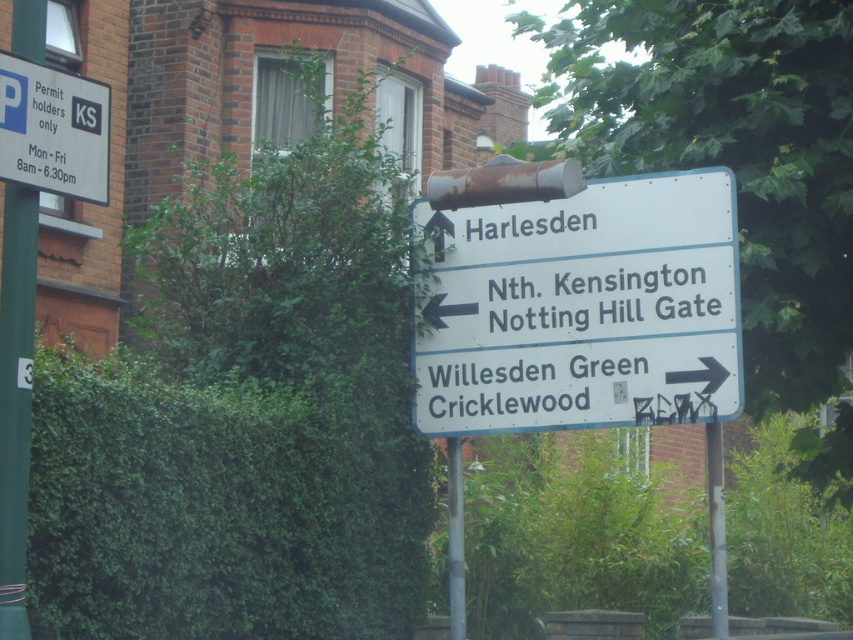
Question: Observing the image, what is the correct spatial positioning of white plastic sign at upper center in reference to green painted metal pole at left?

Choices:
 (A) above
 (B) below

Answer: (A)

Question: Which point is farther to the camera?

Choices:
 (A) green leafy hedge at lower left
 (B) white plastic parking sign at upper left

Answer: (A)

Question: Which of these objects is positioned closest to the white plastic sign at upper center?

Choices:
 (A) white plastic parking sign at upper left
 (B) green leafy hedge at lower left
 (C) green painted metal pole at left

Answer: (B)

Question: Estimate the real-world distances between objects in this image. Which object is farther from the green painted metal pole at left?

Choices:
 (A) white plastic parking sign at upper left
 (B) white plastic sign at upper center
 (C) green leafy hedge at lower left

Answer: (B)

Question: Can you confirm if green leafy hedge at lower left is thinner than white plastic parking sign at upper left?

Choices:
 (A) yes
 (B) no

Answer: (B)

Question: Can you confirm if green leafy hedge at lower left is wider than white plastic sign at upper center?

Choices:
 (A) yes
 (B) no

Answer: (B)